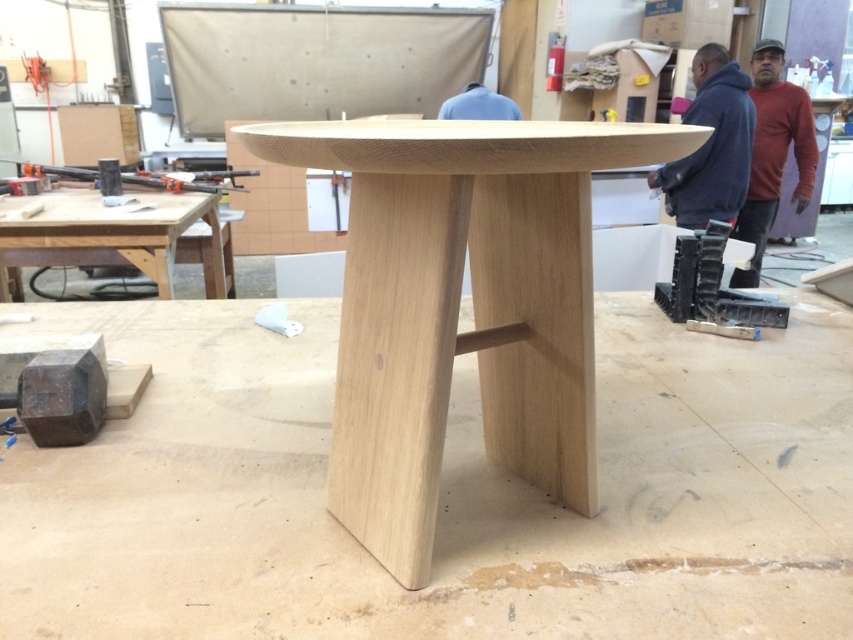
Question: Which point is farther from the camera taking this photo?

Choices:
 (A) (303, 157)
 (B) (33, 257)

Answer: (B)

Question: Can you confirm if natural wood table at center is positioned to the left of natural wood table at left?

Choices:
 (A) yes
 (B) no

Answer: (B)

Question: Does natural wood table at center appear over natural wood table at left?

Choices:
 (A) yes
 (B) no

Answer: (B)

Question: Which object appears closest to the camera in this image?

Choices:
 (A) natural wood table at center
 (B) natural wood table at left

Answer: (A)

Question: Observing the image, what is the correct spatial positioning of natural wood table at center in reference to natural wood table at left?

Choices:
 (A) above
 (B) below

Answer: (B)